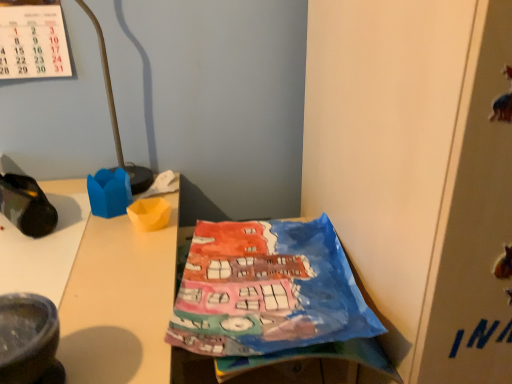
Question: Is metallic gold lamp at upper left facing away from watercolor paper at center?

Choices:
 (A) no
 (B) yes

Answer: (A)

Question: Is metallic gold lamp at upper left surrounding watercolor paper at center?

Choices:
 (A) no
 (B) yes

Answer: (A)

Question: Is metallic gold lamp at upper left thinner than watercolor paper at center?

Choices:
 (A) yes
 (B) no

Answer: (A)

Question: Does metallic gold lamp at upper left lie behind watercolor paper at center?

Choices:
 (A) yes
 (B) no

Answer: (A)

Question: Is metallic gold lamp at upper left shorter than watercolor paper at center?

Choices:
 (A) yes
 (B) no

Answer: (B)

Question: From a real-world perspective, is watercolor paper at center positioned above or below camouflage fabric shoe at left?

Choices:
 (A) above
 (B) below

Answer: (B)

Question: Considering the positions of watercolor paper at center and camouflage fabric shoe at left in the image, is watercolor paper at center bigger or smaller than camouflage fabric shoe at left?

Choices:
 (A) small
 (B) big

Answer: (B)

Question: Which is correct: watercolor paper at center is inside camouflage fabric shoe at left, or outside of it?

Choices:
 (A) outside
 (B) inside

Answer: (A)

Question: From their relative heights in the image, would you say watercolor paper at center is taller or shorter than camouflage fabric shoe at left?

Choices:
 (A) short
 (B) tall

Answer: (B)

Question: From the image's perspective, is camouflage fabric shoe at left located above or below metallic gold lamp at upper left?

Choices:
 (A) below
 (B) above

Answer: (A)

Question: Looking at the image, does camouflage fabric shoe at left seem bigger or smaller compared to metallic gold lamp at upper left?

Choices:
 (A) big
 (B) small

Answer: (B)

Question: Which is correct: camouflage fabric shoe at left is inside metallic gold lamp at upper left, or outside of it?

Choices:
 (A) inside
 (B) outside

Answer: (B)

Question: Is point (17, 220) closer or farther from the camera than point (111, 54)?

Choices:
 (A) closer
 (B) farther

Answer: (A)

Question: Considering the positions of metallic gold lamp at upper left and watercolor paper at center in the image, is metallic gold lamp at upper left taller or shorter than watercolor paper at center?

Choices:
 (A) short
 (B) tall

Answer: (B)

Question: Is metallic gold lamp at upper left bigger or smaller than watercolor paper at center?

Choices:
 (A) small
 (B) big

Answer: (A)